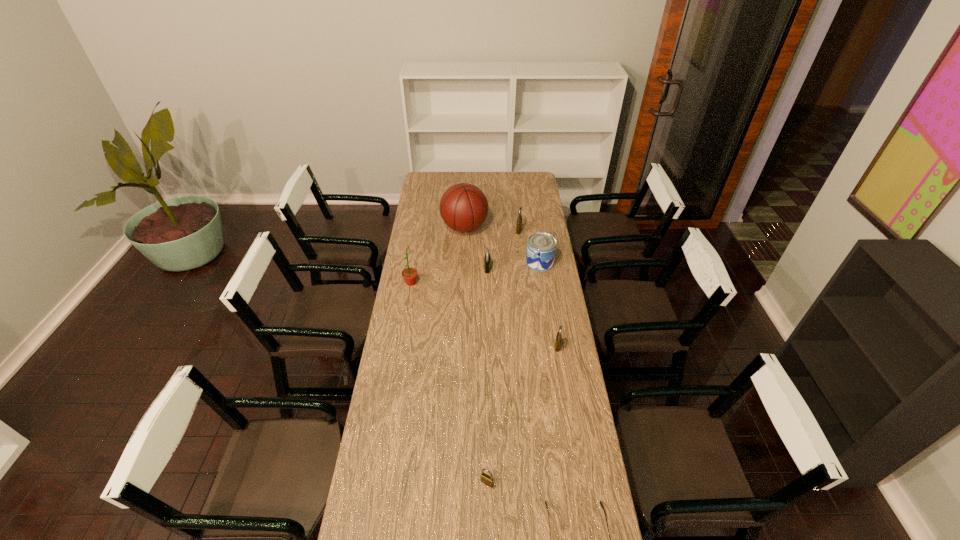
The width and height of the screenshot is (960, 540). In order to click on blank space that satisfies the following two spatial constraints: 1. on the front label of the can; 2. on the left side of the third farthest padlock in this screenshot , I will do `click(552, 346)`.

Locate an element on the screen. free location that satisfies the following two spatial constraints: 1. on the face of the sunflower; 2. on the left side of the rightmost brass padlock is located at coordinates (400, 346).